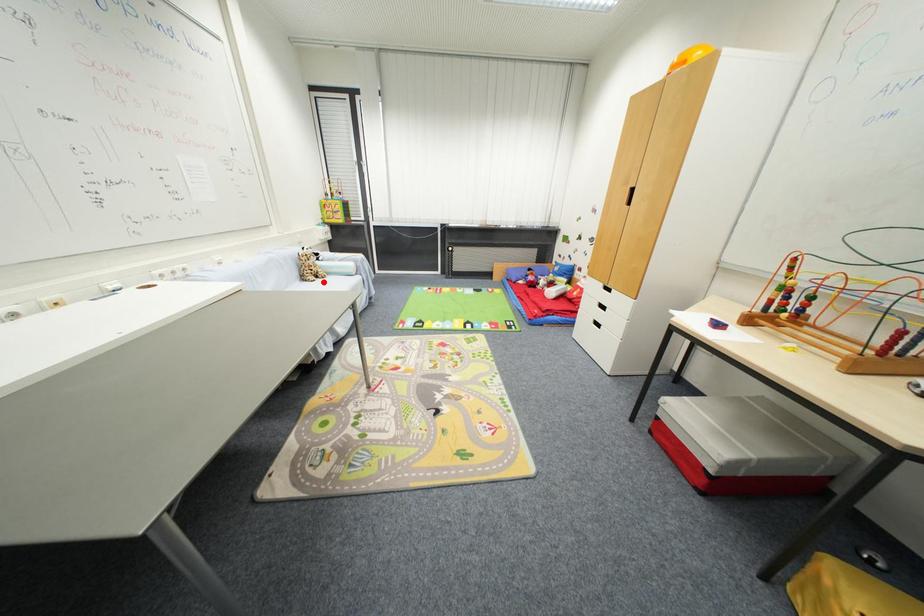
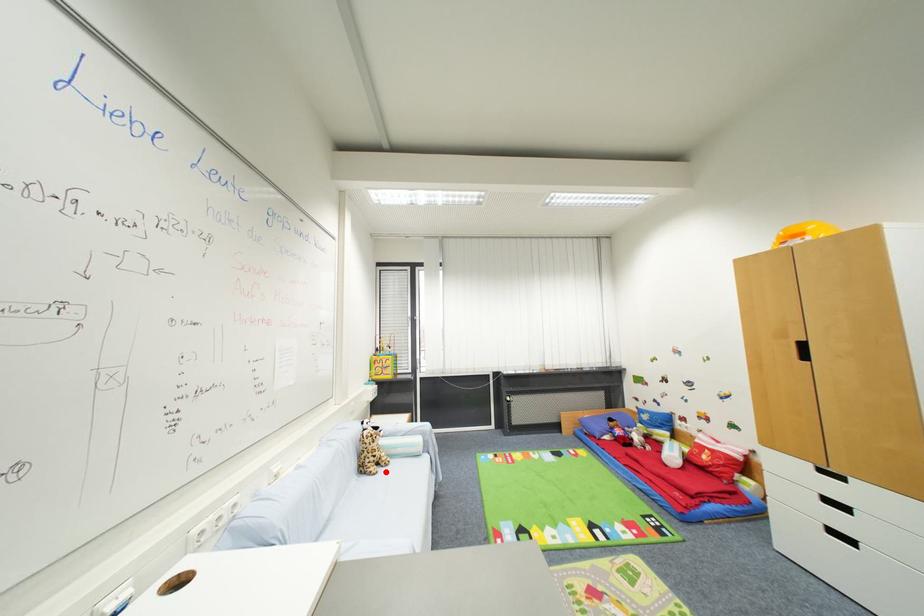
I am providing you with two images of the same scene from different viewpoints. A red point is marked on the first image and another point is marked on the second image. Do the highlighted points in image1 and image2 indicate the same real-world spot?

Yes